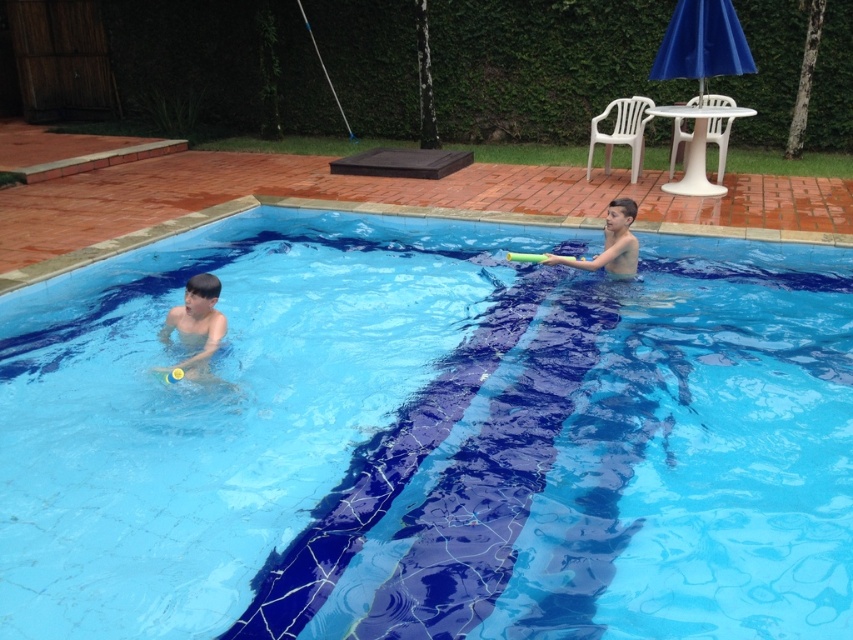
Question: Is transparent blue water at center to the left of matte black boy at left from the viewer's perspective?

Choices:
 (A) yes
 (B) no

Answer: (B)

Question: Which of the following is the closest to the observer?

Choices:
 (A) (462, 554)
 (B) (592, 257)

Answer: (A)

Question: Is matte black boy at left bigger than smooth yellow toy at upper right?

Choices:
 (A) yes
 (B) no

Answer: (B)

Question: Which point is closer to the camera?

Choices:
 (A) transparent blue water at center
 (B) smooth yellow toy at upper right

Answer: (A)

Question: Which object is farther from the camera taking this photo?

Choices:
 (A) transparent blue water at center
 (B) matte black boy at left
 (C) smooth yellow toy at upper right

Answer: (C)

Question: Does transparent blue water at center lie behind matte black boy at left?

Choices:
 (A) no
 (B) yes

Answer: (A)